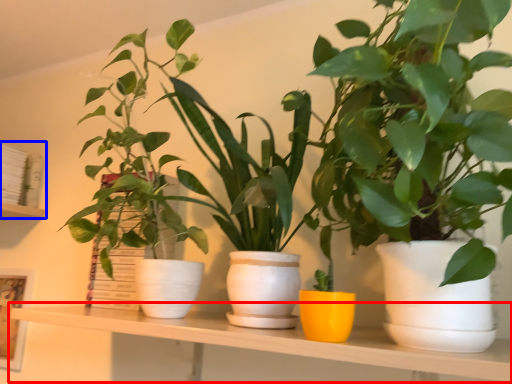
Question: Which of the following is the farthest to the observer, table (highlighted by a red box) or shelf (highlighted by a blue box)?

Choices:
 (A) table
 (B) shelf

Answer: (B)